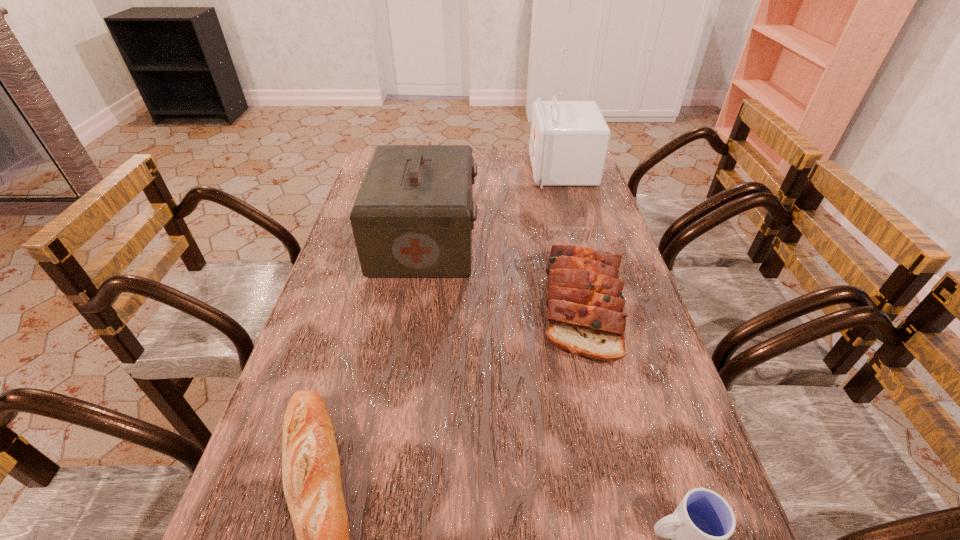
The image size is (960, 540). I want to click on object located at the left edge, so click(413, 216).

Locate an element on the screen. The width and height of the screenshot is (960, 540). the first-aid kit positioned at the right edge is located at coordinates (569, 140).

Where is `bread located at the right edge`? The height and width of the screenshot is (540, 960). bread located at the right edge is located at coordinates (585, 312).

Find the location of `object present at the far right corner`. object present at the far right corner is located at coordinates (569, 140).

In the image, there is a desktop. Identify the location of vacant space at the far edge. (482, 176).

Where is `free space at the left edge of the desktop`? The height and width of the screenshot is (540, 960). free space at the left edge of the desktop is located at coordinates (248, 488).

In the image, there is a desktop. Identify the location of vacant area at the right edge. (639, 321).

What are the coordinates of `unoccupied area between the farther first-aid kit and the bread` in the screenshot? It's located at (572, 237).

This screenshot has width=960, height=540. I want to click on free spot between the bread and the left first-aid kit, so click(x=504, y=272).

You are a GUI agent. You are given a task and a screenshot of the screen. Output one action in this format:
    pyautogui.click(x=<x>, y=<y>)
    Task: Click on the vacant area between the third tallest object and the left first-aid kit
    
    Given the screenshot: What is the action you would take?
    pyautogui.click(x=504, y=272)